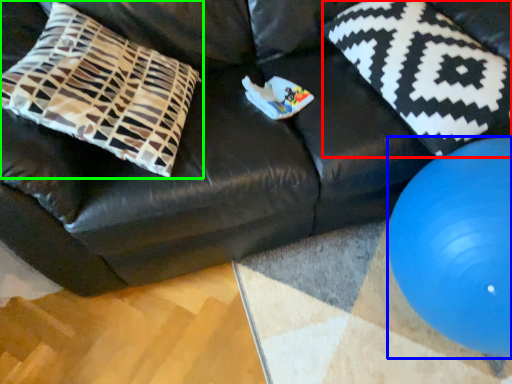
Question: Which object is positioned closest to pillow (highlighted by a red box)? Select from ball (highlighted by a blue box) and pillow (highlighted by a green box).

Choices:
 (A) ball
 (B) pillow

Answer: (A)